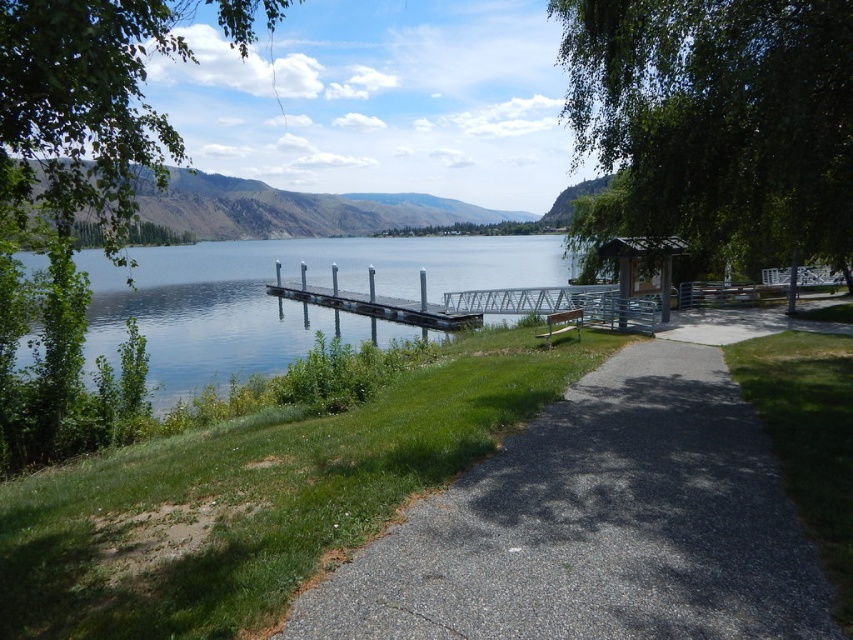
You are a photographer planning to capture the green leafy tree at left and the metallic gray dock at center in a single frame. Based on their positions, which object would appear closer to the top of the photo?

The green leafy tree at left appears closer to the top of the photo because it is positioned above the metallic gray dock at center.

You are a painter wanting to set up your easel on the lakeside. You have two options for placement near the metallic gray dock at center and the metallic silver bench at lower center. Considering their widths, which location offers more space for your equipment?

The metallic gray dock at center has a greater width than the metallic silver bench at lower center, so it offers more space for your equipment.

From the picture: You are standing at the center of the image and want to locate the green leafy tree at left. In which direction should you look to find it?

The green leafy tree at left is located at point 0.237 on the x axis and 0.093 on the y axis. Since the x coordinate is less than 0.5, it is to the left of the center. The y coordinate is also less than 0.5, so it is above the center. Therefore, you should look to the upper left direction to find it.